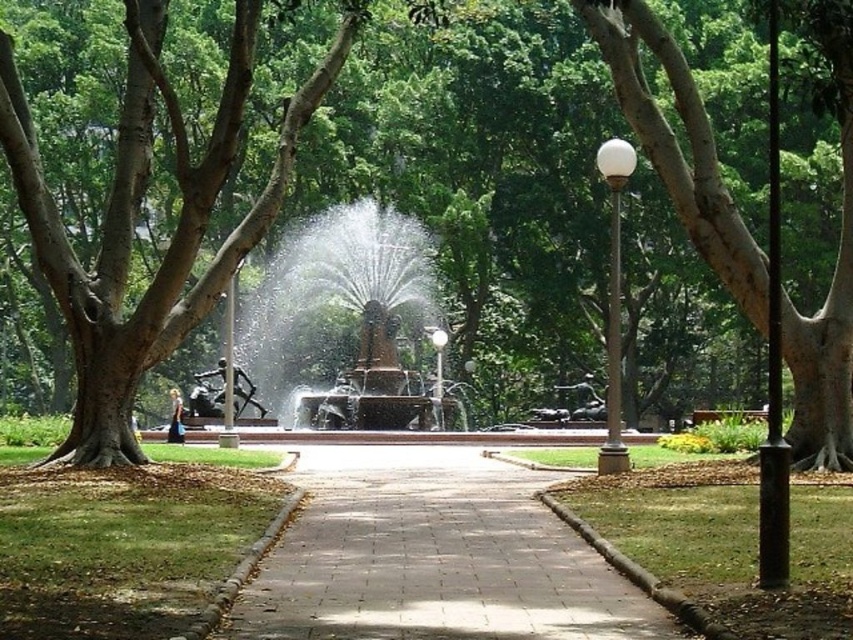
You are standing at the center of the park facing the fountain. Which direction should you look to see the smooth brown tree trunk at left?

The smooth brown tree trunk at left is located at point 0.336 on the x axis and 0.161 on the y axis. Since you are facing the fountain, which is the central focal point, the tree trunk is to your left side.

You are standing at the entrance of the park and want to take a photo of the brown textured tree at center. The camera you are using has a maximum focus range of 8 meters. Will the camera be able to focus on the tree?

The brown textured tree at center is 7.91 meters from camera, so yes, the camera can focus on the tree since it is within the maximum focus range of 8 meters.